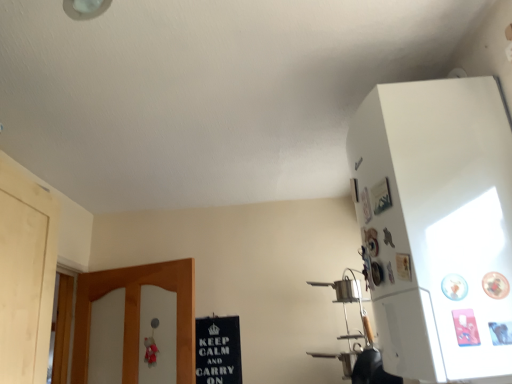
Question: Is white matte refrigerator at upper right thinner than black cardboard sign at lower center?

Choices:
 (A) no
 (B) yes

Answer: (A)

Question: Is white matte refrigerator at upper right positioned with its back to black cardboard sign at lower center?

Choices:
 (A) yes
 (B) no

Answer: (B)

Question: Considering the relative sizes of white matte refrigerator at upper right and black cardboard sign at lower center in the image provided, is white matte refrigerator at upper right shorter than black cardboard sign at lower center?

Choices:
 (A) yes
 (B) no

Answer: (B)

Question: From a real-world perspective, is white matte refrigerator at upper right on black cardboard sign at lower center?

Choices:
 (A) yes
 (B) no

Answer: (A)

Question: Considering the relative sizes of white matte refrigerator at upper right and black cardboard sign at lower center in the image provided, is white matte refrigerator at upper right smaller than black cardboard sign at lower center?

Choices:
 (A) yes
 (B) no

Answer: (B)

Question: From the image's perspective, is white matte refrigerator at upper right on top of black cardboard sign at lower center?

Choices:
 (A) no
 (B) yes

Answer: (B)

Question: Is white matte refrigerator at upper right surrounded by black cardboard sign at lower center?

Choices:
 (A) no
 (B) yes

Answer: (A)

Question: From the image's perspective, is black cardboard sign at lower center above white matte refrigerator at upper right?

Choices:
 (A) no
 (B) yes

Answer: (A)

Question: Is black cardboard sign at lower center positioned before white matte refrigerator at upper right?

Choices:
 (A) yes
 (B) no

Answer: (B)

Question: Considering the relative sizes of black cardboard sign at lower center and white matte refrigerator at upper right in the image provided, is black cardboard sign at lower center smaller than white matte refrigerator at upper right?

Choices:
 (A) yes
 (B) no

Answer: (A)

Question: Is black cardboard sign at lower center positioned behind white matte refrigerator at upper right?

Choices:
 (A) no
 (B) yes

Answer: (B)

Question: Is black cardboard sign at lower center next to white matte refrigerator at upper right and touching it?

Choices:
 (A) no
 (B) yes

Answer: (A)

Question: From the image's perspective, is black cardboard sign at lower center above or below white matte refrigerator at upper right?

Choices:
 (A) below
 (B) above

Answer: (A)